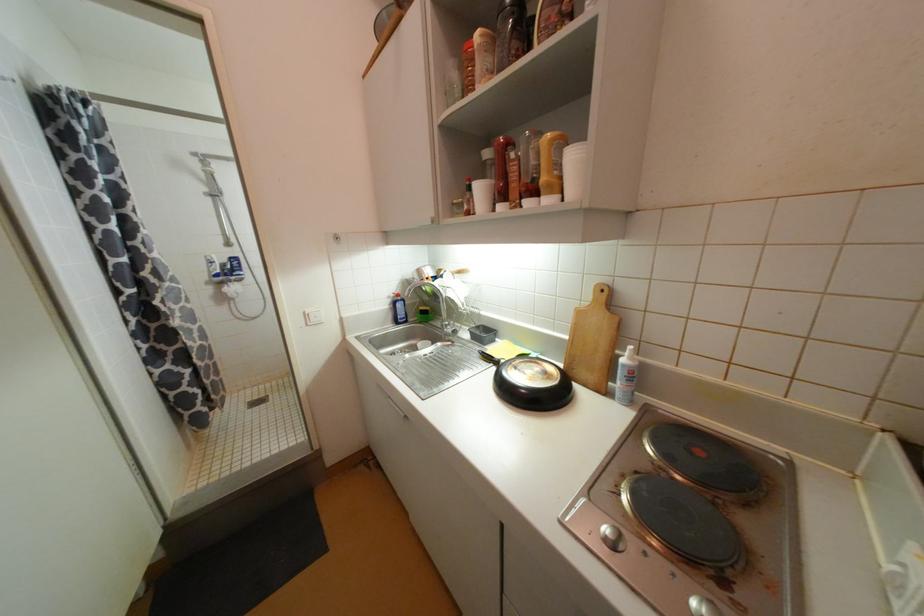
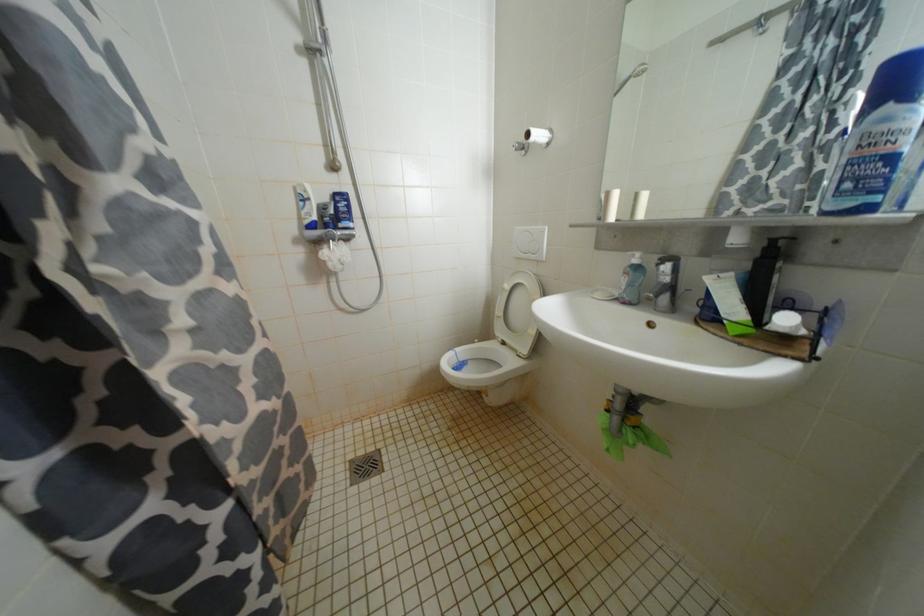
In a continuous first-person perspective shot, in which direction is the camera moving?

The movement direction of the cameraman is left, forward.